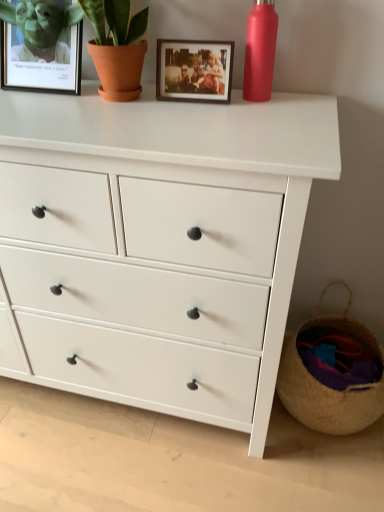
Identify the location of free spot in front of matte black picture frame at upper left, marked as the 1th picture frame in a left-to-right arrangement. (51, 109).